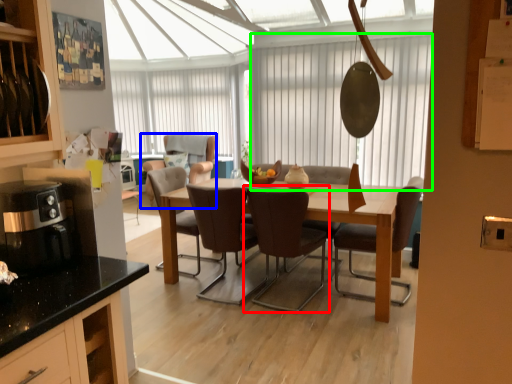
Question: Based on their relative distances, which object is farther from chair (highlighted by a red box)? Choose from chair (highlighted by a blue box) and window screen (highlighted by a green box).

Choices:
 (A) chair
 (B) window screen

Answer: (B)